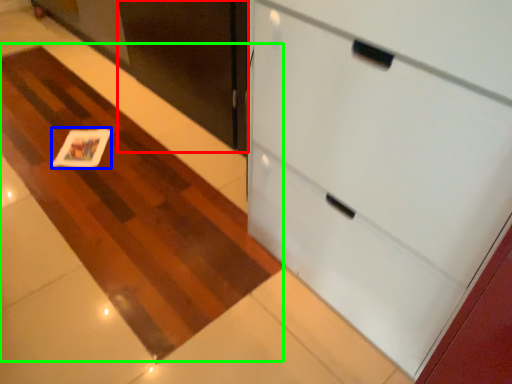
Question: Which object is positioned closest to door (highlighted by a red box)? Select from card (highlighted by a blue box) and plain (highlighted by a green box).

Choices:
 (A) card
 (B) plain

Answer: (B)